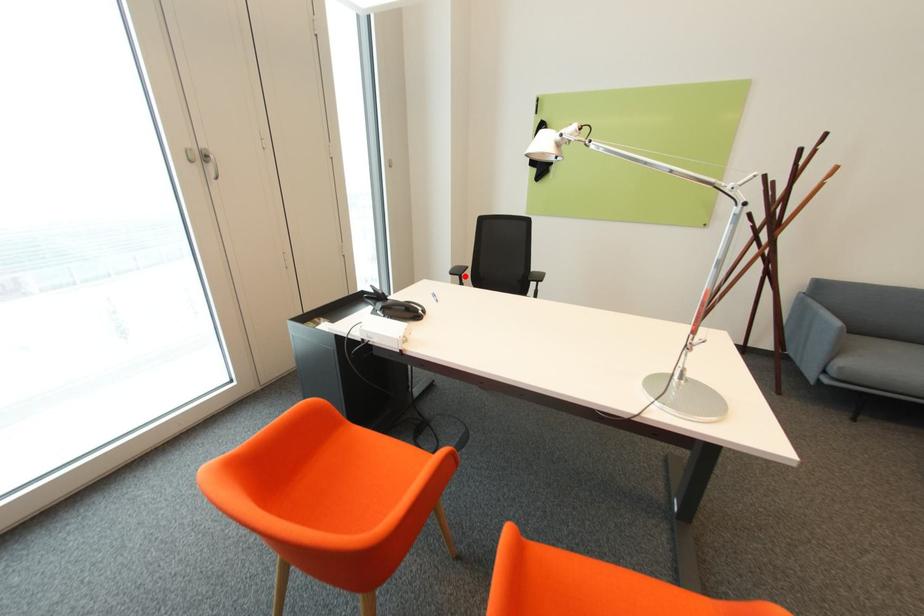
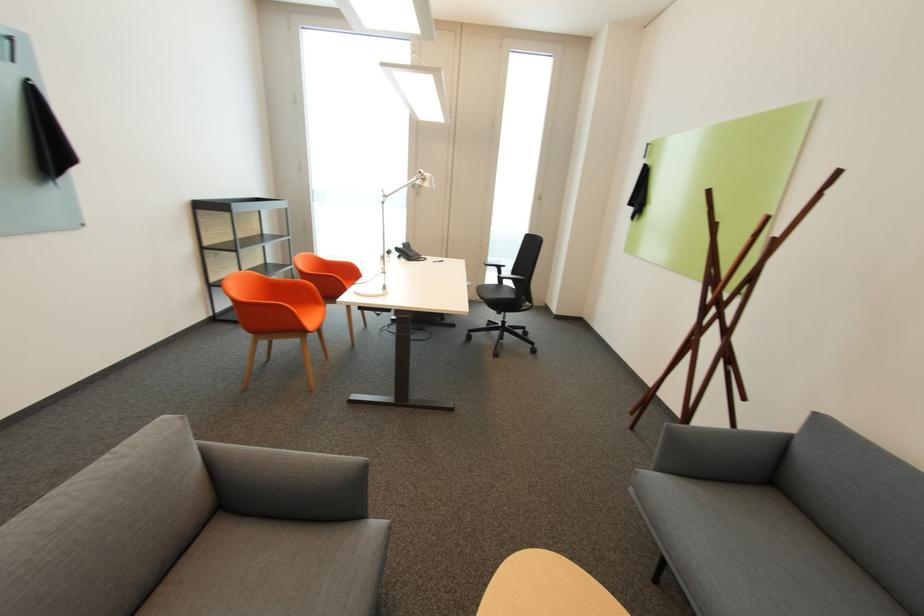
Question: I am providing you with two images of the same scene from different viewpoints. Given a red point in image1, look at the same physical point in image2. Is it:

Choices:
 (A) Closer to the viewpoint
 (B) Farther from the viewpoint

Answer: (A)